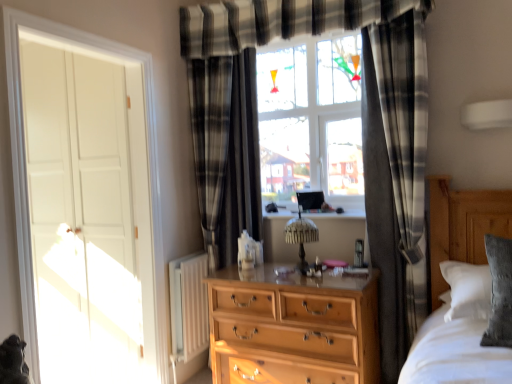
In the scene shown: Measure the distance between white matte door at left and camera.

A distance of 1.99 meters exists between white matte door at left and camera.

I want to click on black plaid curtain at center, the 1th curtain viewed from the left, so click(226, 151).

From a real-world perspective, is silvery fur cat at lower left under black plaid curtain at center, which appears as the second curtain when viewed from the right?

Correct, in the physical world, silvery fur cat at lower left is lower than black plaid curtain at center, which appears as the second curtain when viewed from the right.

Is silvery fur cat at lower left not close to black plaid curtain at center, the 2th curtain when ordered from front to back?

Yes, silvery fur cat at lower left is far from black plaid curtain at center, the 2th curtain when ordered from front to back.

Consider the image. Is silvery fur cat at lower left positioned with its back to black plaid curtain at center, the 1th curtain when ordered from back to front?

silvery fur cat at lower left is not turned away from black plaid curtain at center, the 1th curtain when ordered from back to front.

Is black plaid curtain at center, the 1th curtain viewed from the left, positioned beyond the bounds of black plaid curtain at right, the 1th curtain in the front-to-back sequence?

Yes, black plaid curtain at center, the 1th curtain viewed from the left, is not within black plaid curtain at right, the 1th curtain in the front-to-back sequence.

Considering the relative positions of black plaid curtain at center, the 1th curtain when ordered from back to front, and black plaid curtain at right, which is counted as the first curtain, starting from the right, in the image provided, is black plaid curtain at center, the 1th curtain when ordered from back to front, in front of black plaid curtain at right, which is counted as the first curtain, starting from the right,?

That is False.

Is point (243, 61) closer or farther from the camera than point (420, 206)?

Clearly, point (243, 61) is more distant from the camera than point (420, 206).

Which object is positioned more to the left, black plaid curtain at center, which appears as the second curtain when viewed from the right, or silvery fur cat at lower left?

From the viewer's perspective, silvery fur cat at lower left appears more on the left side.

Is black plaid curtain at center, which appears as the second curtain when viewed from the right, wider or thinner than silvery fur cat at lower left?

black plaid curtain at center, which appears as the second curtain when viewed from the right, is thinner than silvery fur cat at lower left.

Is black plaid curtain at center, the 2th curtain when ordered from front to back, surrounding silvery fur cat at lower left?

Actually, silvery fur cat at lower left is outside black plaid curtain at center, the 2th curtain when ordered from front to back.

From the image's perspective, would you say black plaid curtain at center, the 1th curtain when ordered from back to front, is positioned over silvery fur cat at lower left?

Yes.

Based on the photo, does black plaid curtain at right, the second curtain viewed from the left, have a greater height compared to white matte door at left?

Yes.

Find the location of a particular element. The image size is (512, 384). screen door in front of the black plaid curtain at right, which is counted as the first curtain, starting from the right is located at coordinates (88, 211).

Based on the photo, from the image's perspective, is black plaid curtain at right, which is the 2th curtain in back-to-front order, located above or below white matte door at left?

black plaid curtain at right, which is the 2th curtain in back-to-front order, is situated higher than white matte door at left in the image.

From the image's perspective, is white matte door at left under black plaid curtain at right, which is counted as the first curtain, starting from the right?

Yes.

Is white matte door at left touching black plaid curtain at right, the 1th curtain in the front-to-back sequence?

white matte door at left and black plaid curtain at right, the 1th curtain in the front-to-back sequence, are not in contact.

Who is shorter, white matte door at left or black plaid curtain at right, which is the 2th curtain in back-to-front order?

With less height is white matte door at left.

Is point (125, 306) closer to camera compared to point (0, 375)?

No, it is behind (0, 375).

Would you consider white matte door at left to be distant from silvery fur cat at lower left?

Yes, white matte door at left is far from silvery fur cat at lower left.

Is white matte door at left positioned in front of silvery fur cat at lower left?

That is False.

Would you say silvery fur cat at lower left is part of white matte door at left's contents?

That's incorrect, silvery fur cat at lower left is not inside white matte door at left.

Is there a large distance between silvery fur cat at lower left and white matte door at left?

Yes, silvery fur cat at lower left and white matte door at left are quite far apart.

Does point (8, 338) come closer to viewer compared to point (21, 89)?

That is True.

In the scene shown: Does silvery fur cat at lower left have a lesser width compared to white matte door at left?

Incorrect, the width of silvery fur cat at lower left is not less than that of white matte door at left.

Considering the relative positions of silvery fur cat at lower left and white matte door at left in the image provided, is silvery fur cat at lower left to the right of white matte door at left from the viewer's perspective?

In fact, silvery fur cat at lower left is to the left of white matte door at left.

You are a GUI agent. You are given a task and a screenshot of the screen. Output one action in this format:
    pyautogui.click(x=<x>, y=<y>)
    Task: Click on the 2nd curtain positioned above the silvery fur cat at lower left (from the image's perspective)
    
    Given the screenshot: What is the action you would take?
    pyautogui.click(x=226, y=151)

The width and height of the screenshot is (512, 384). Identify the location of curtain on the right of black plaid curtain at center, the 2th curtain when ordered from front to back. (396, 176).

From the image, which object appears to be nearer to black plaid curtain at center, the 2th curtain when ordered from front to back, white matte door at left or silvery fur cat at lower left?

white matte door at left.

Looking at the image, which one is located further to black plaid curtain at center, the 1th curtain when ordered from back to front, white matte door at left or black plaid curtain at right, the 1th curtain in the front-to-back sequence?

black plaid curtain at right, the 1th curtain in the front-to-back sequence, lies further to black plaid curtain at center, the 1th curtain when ordered from back to front, than the other object.

When comparing their distances from black plaid curtain at right, which is the 2th curtain in back-to-front order, does white matte door at left or black plaid curtain at center, the 1th curtain viewed from the left, seem closer?

black plaid curtain at center, the 1th curtain viewed from the left, is closer to black plaid curtain at right, which is the 2th curtain in back-to-front order.

When comparing their distances from silvery fur cat at lower left, does black plaid curtain at right, the 1th curtain in the front-to-back sequence, or black plaid curtain at center, the 2th curtain when ordered from front to back, seem closer?

Result: black plaid curtain at center, the 2th curtain when ordered from front to back, is closer to silvery fur cat at lower left.

Estimate the real-world distances between objects in this image. Which object is closer to black plaid curtain at center, the 2th curtain when ordered from front to back, silvery fur cat at lower left or black plaid curtain at right, the second curtain viewed from the left?

Based on the image, black plaid curtain at right, the second curtain viewed from the left, appears to be nearer to black plaid curtain at center, the 2th curtain when ordered from front to back.

Considering their positions, is black plaid curtain at right, the second curtain viewed from the left, positioned further to silvery fur cat at lower left than white matte door at left?

black plaid curtain at right, the second curtain viewed from the left.

Consider the image. Estimate the real-world distances between objects in this image. Which object is further from black plaid curtain at right, the second curtain viewed from the left, silvery fur cat at lower left or white matte door at left?

Among the two, silvery fur cat at lower left is located further to black plaid curtain at right, the second curtain viewed from the left.

Looking at the image, which one is located further to silvery fur cat at lower left, black plaid curtain at center, the 1th curtain when ordered from back to front, or white matte door at left?

black plaid curtain at center, the 1th curtain when ordered from back to front, is further to silvery fur cat at lower left.

Image resolution: width=512 pixels, height=384 pixels. I want to click on curtain between silvery fur cat at lower left and black plaid curtain at right, the second curtain viewed from the left, from left to right, so click(x=226, y=151).

Locate an element on the screen. curtain located between white matte door at left and black plaid curtain at right, the 1th curtain in the front-to-back sequence, in the left-right direction is located at coordinates (226, 151).

Image resolution: width=512 pixels, height=384 pixels. I want to click on screen door between silvery fur cat at lower left and black plaid curtain at right, which is counted as the first curtain, starting from the right, in the horizontal direction, so click(88, 211).

The width and height of the screenshot is (512, 384). In order to click on screen door between silvery fur cat at lower left and black plaid curtain at center, the 1th curtain when ordered from back to front, in the front-back direction in this screenshot , I will do `click(88, 211)`.